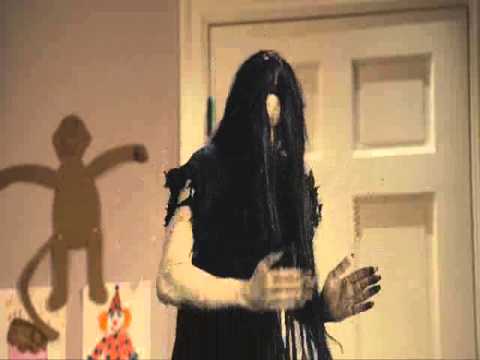
Find the location of a particular element. door is located at coordinates (375, 188).